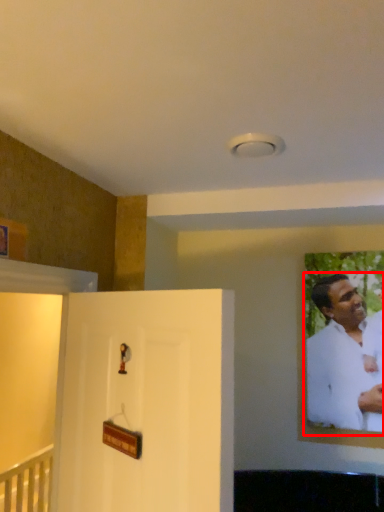
Question: From the image's perspective, where is man (annotated by the red box) located relative to door?

Choices:
 (A) below
 (B) above

Answer: (B)